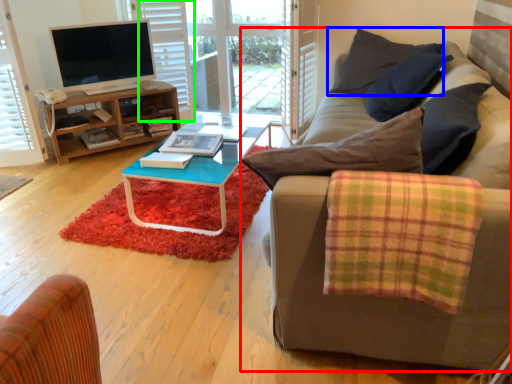
Question: Which is nearer to the studio couch (highlighted by a red box)? pillow (highlighted by a blue box) or shutter (highlighted by a green box).

Choices:
 (A) pillow
 (B) shutter

Answer: (A)